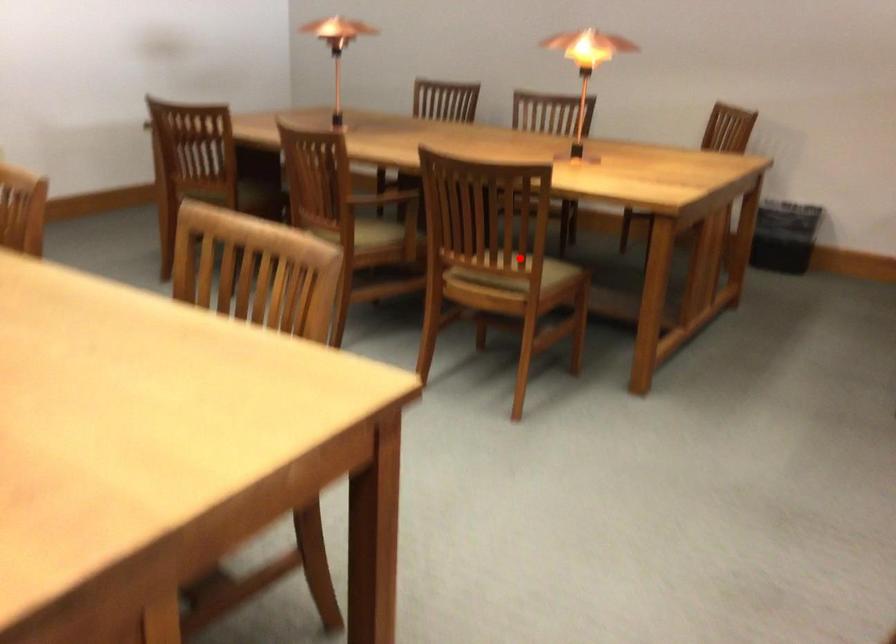
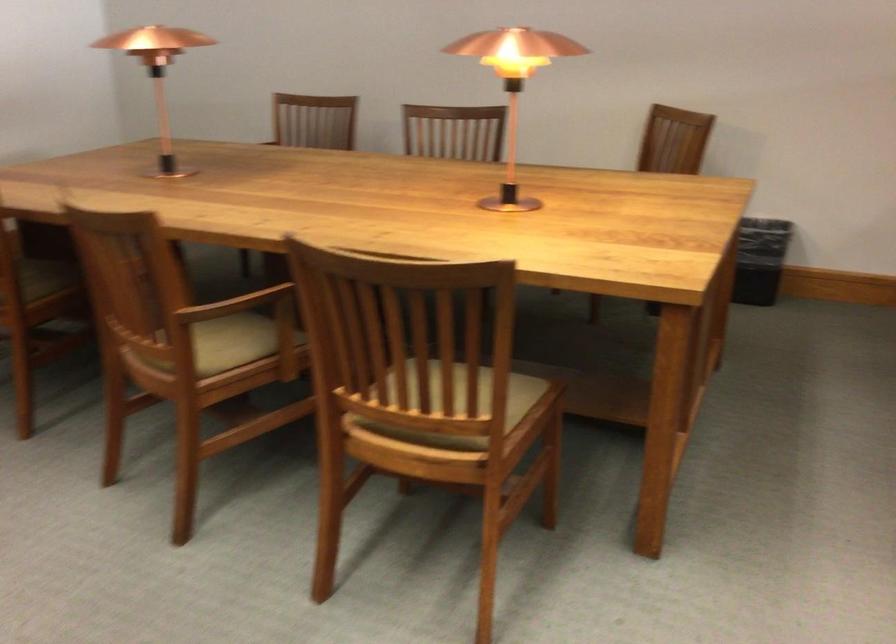
Locate, in the second image, the point that corresponds to the highlighted location in the first image.

(460, 404)